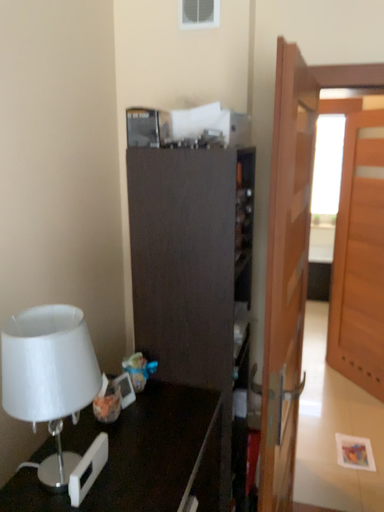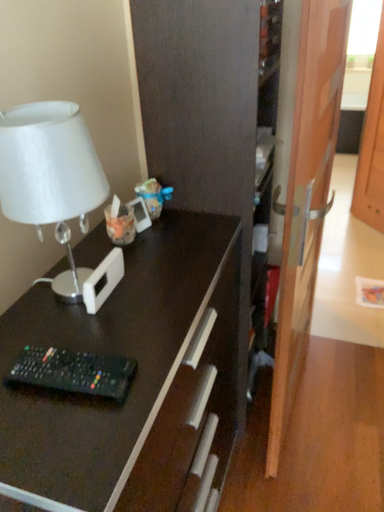
Question: How did the camera likely rotate when shooting the video?

Choices:
 (A) rotated upward
 (B) rotated downward

Answer: (B)